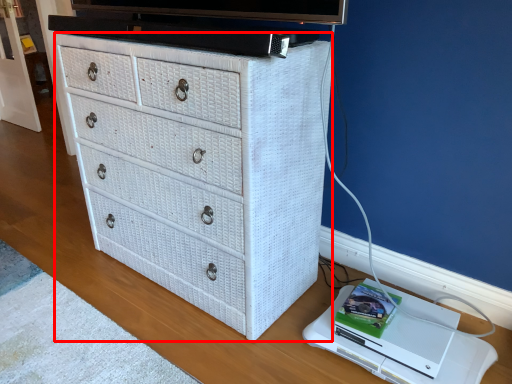
Question: From the image's perspective, where is chest of drawers (annotated by the red box) located in relation to computer in the image?

Choices:
 (A) above
 (B) below

Answer: (A)